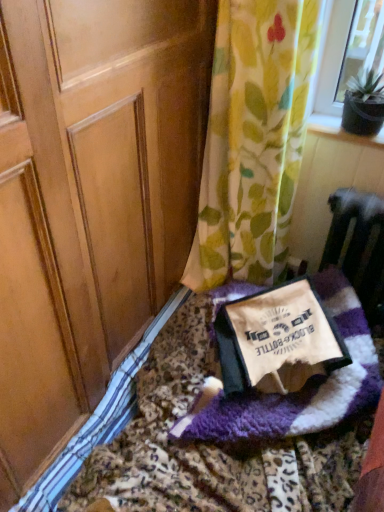
Question: Can you confirm if purple fuzzy blanket at lower right is bigger than beige fleece blanket at center?

Choices:
 (A) yes
 (B) no

Answer: (A)

Question: Is purple fuzzy blanket at lower right turned away from beige fleece blanket at center?

Choices:
 (A) yes
 (B) no

Answer: (B)

Question: From the image's perspective, does purple fuzzy blanket at lower right appear higher than beige fleece blanket at center?

Choices:
 (A) no
 (B) yes

Answer: (A)

Question: From the image's perspective, is purple fuzzy blanket at lower right below beige fleece blanket at center?

Choices:
 (A) no
 (B) yes

Answer: (B)

Question: From a real-world perspective, is purple fuzzy blanket at lower right positioned over beige fleece blanket at center based on gravity?

Choices:
 (A) no
 (B) yes

Answer: (A)

Question: Is purple fuzzy blanket at lower right smaller than beige fleece blanket at center?

Choices:
 (A) no
 (B) yes

Answer: (A)

Question: Considering the relative sizes of floral fabric curtain at upper right and beige fleece blanket at center in the image provided, is floral fabric curtain at upper right bigger than beige fleece blanket at center?

Choices:
 (A) no
 (B) yes

Answer: (B)

Question: Does floral fabric curtain at upper right appear on the left side of beige fleece blanket at center?

Choices:
 (A) yes
 (B) no

Answer: (A)

Question: Could you tell me if floral fabric curtain at upper right is facing beige fleece blanket at center?

Choices:
 (A) yes
 (B) no

Answer: (B)

Question: Does floral fabric curtain at upper right lie behind beige fleece blanket at center?

Choices:
 (A) no
 (B) yes

Answer: (A)

Question: From the image's perspective, does floral fabric curtain at upper right appear higher than beige fleece blanket at center?

Choices:
 (A) no
 (B) yes

Answer: (B)

Question: Considering the relative sizes of floral fabric curtain at upper right and beige fleece blanket at center in the image provided, is floral fabric curtain at upper right taller than beige fleece blanket at center?

Choices:
 (A) yes
 (B) no

Answer: (A)

Question: From a real-world perspective, is floral fabric curtain at upper right beneath purple fuzzy blanket at lower right?

Choices:
 (A) yes
 (B) no

Answer: (B)